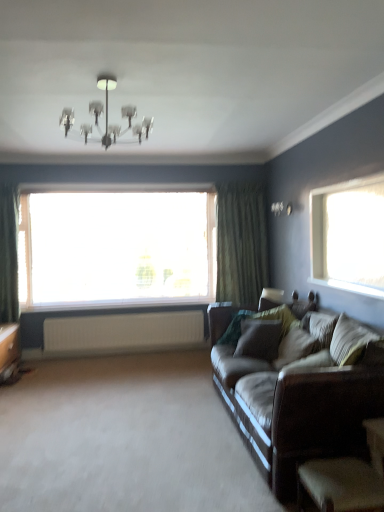
Question: Could you tell me if white ribbed radiator at lower center is turned towards brown leather couch at right?

Choices:
 (A) no
 (B) yes

Answer: (B)

Question: Would you say white ribbed radiator at lower center is outside brown leather couch at right?

Choices:
 (A) no
 (B) yes

Answer: (B)

Question: Does white ribbed radiator at lower center have a smaller size compared to brown leather couch at right?

Choices:
 (A) yes
 (B) no

Answer: (A)

Question: Is white ribbed radiator at lower center at the right side of brown leather couch at right?

Choices:
 (A) no
 (B) yes

Answer: (A)

Question: From the image's perspective, does white ribbed radiator at lower center appear higher than brown leather couch at right?

Choices:
 (A) no
 (B) yes

Answer: (A)

Question: Relative to green textured curtain at right, is metallic chandelier at upper center in front or behind?

Choices:
 (A) behind
 (B) front

Answer: (B)

Question: Does point (84, 138) appear closer or farther from the camera than point (231, 198)?

Choices:
 (A) closer
 (B) farther

Answer: (A)

Question: Is metallic chandelier at upper center inside or outside of green textured curtain at right?

Choices:
 (A) inside
 (B) outside

Answer: (B)

Question: From the image's perspective, is metallic chandelier at upper center located above or below green textured curtain at right?

Choices:
 (A) above
 (B) below

Answer: (A)

Question: Considering the relative positions of white ribbed radiator at lower center and white plastic window sill at center in the image provided, is white ribbed radiator at lower center to the left or to the right of white plastic window sill at center?

Choices:
 (A) right
 (B) left

Answer: (A)

Question: Considering the positions of white ribbed radiator at lower center and white plastic window sill at center in the image, is white ribbed radiator at lower center wider or thinner than white plastic window sill at center?

Choices:
 (A) wide
 (B) thin

Answer: (B)

Question: Is white ribbed radiator at lower center inside the boundaries of white plastic window sill at center, or outside?

Choices:
 (A) inside
 (B) outside

Answer: (B)

Question: Considering the positions of white ribbed radiator at lower center and white plastic window sill at center in the image, is white ribbed radiator at lower center taller or shorter than white plastic window sill at center?

Choices:
 (A) tall
 (B) short

Answer: (A)

Question: In the image, is white plastic window sill at center positioned in front of or behind white ribbed radiator at lower center?

Choices:
 (A) behind
 (B) front

Answer: (A)

Question: From a real-world perspective, is white plastic window sill at center physically located above or below white ribbed radiator at lower center?

Choices:
 (A) below
 (B) above

Answer: (B)